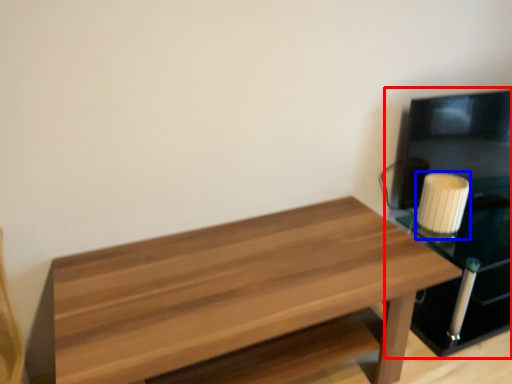
Question: Which object is further to the camera taking this photo, entertainment center (highlighted by a red box) or candle holder (highlighted by a blue box)?

Choices:
 (A) entertainment center
 (B) candle holder

Answer: (B)